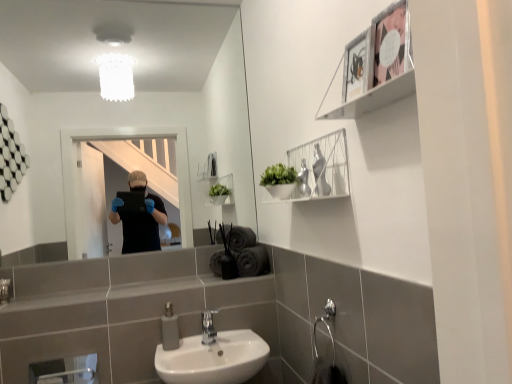
At what (x,y) coordinates should I click in order to perform the action: click on vacant area situated below clear glass mirror at upper center (from a real-world perspective). Please return your answer as a coordinate pair (x, y). The image size is (512, 384). Looking at the image, I should click on (139, 275).